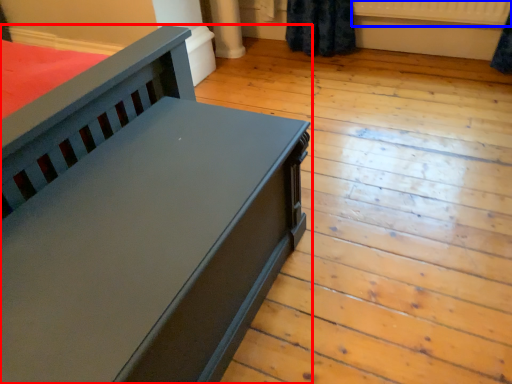
Question: Which of the following is the farthest to the observer, furniture (highlighted by a red box) or radiator (highlighted by a blue box)?

Choices:
 (A) furniture
 (B) radiator

Answer: (B)